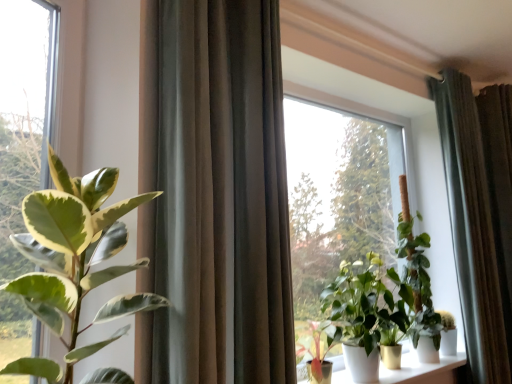
I want to click on white glossy pots at lower center, so click(423, 370).

I want to click on green glossy plant at center, the 2th houseplant positioned from the back, so click(x=366, y=315).

Locate an element on the screen. The height and width of the screenshot is (384, 512). satin dark green curtain at right, the second curtain in the left-to-right sequence is located at coordinates [473, 231].

At what (x,y) coordinates should I click in order to perform the action: click on green leafy plant at left. Please return your answer as a coordinate pair (x, y). Looking at the image, I should click on (25, 113).

This screenshot has height=384, width=512. Describe the element at coordinates (317, 348) in the screenshot. I see `green matte plant at center, the second houseplant in the left-to-right sequence` at that location.

Measure the distance between point (318,340) and camera.

They are 7.11 feet apart.

The height and width of the screenshot is (384, 512). Describe the element at coordinates (74, 261) in the screenshot. I see `green glossy leafy plant at left, positioned as the 4th houseplant in back-to-front order` at that location.

You are a GUI agent. You are given a task and a screenshot of the screen. Output one action in this format:
    pyautogui.click(x=<x>, y=<y>)
    Task: Click on the white glossy pots at lower center
    The width and height of the screenshot is (512, 384).
    Given the screenshot: What is the action you would take?
    pyautogui.click(x=423, y=370)

Can you confirm if green leafy plant at left is shorter than satin dark green curtain at right, positioned as the first curtain in right-to-left order?

Indeed, green leafy plant at left has a lesser height compared to satin dark green curtain at right, positioned as the first curtain in right-to-left order.

Which of these two, green leafy plant at left or satin dark green curtain at right, which is counted as the first curtain, starting from the back, is wider?

Wider between the two is satin dark green curtain at right, which is counted as the first curtain, starting from the back.

Where is `the 2nd curtain behind the green leafy plant at left`? the 2nd curtain behind the green leafy plant at left is located at coordinates (473, 231).

From the image's perspective, is green leafy plant at left on top of satin dark green curtain at right, positioned as the first curtain in right-to-left order?

Yes, from the image's perspective, green leafy plant at left is over satin dark green curtain at right, positioned as the first curtain in right-to-left order.

Does point (236, 171) come behind point (464, 322)?

No, (236, 171) is in front of (464, 322).

Could you tell me if satin brown curtain at center, the 2th curtain from the back, is turned towards satin dark green curtain at right, the second curtain in the left-to-right sequence?

No, satin brown curtain at center, the 2th curtain from the back, is not oriented towards satin dark green curtain at right, the second curtain in the left-to-right sequence.

Can you see satin brown curtain at center, the 2th curtain from the back, touching satin dark green curtain at right, which is counted as the first curtain, starting from the back?

No, satin brown curtain at center, the 2th curtain from the back, is not touching satin dark green curtain at right, which is counted as the first curtain, starting from the back.

Is green glossy leafy plant at left, positioned as the 4th houseplant in back-to-front order, positioned far away from satin dark green curtain at right, which is counted as the first curtain, starting from the back?

Yes, green glossy leafy plant at left, positioned as the 4th houseplant in back-to-front order, is far from satin dark green curtain at right, which is counted as the first curtain, starting from the back.

Considering the relative sizes of green glossy leafy plant at left, which appears as the first houseplant when viewed from the front, and satin dark green curtain at right, positioned as the first curtain in right-to-left order, in the image provided, is green glossy leafy plant at left, which appears as the first houseplant when viewed from the front, thinner than satin dark green curtain at right, positioned as the first curtain in right-to-left order,?

Incorrect, the width of green glossy leafy plant at left, which appears as the first houseplant when viewed from the front, is not less than that of satin dark green curtain at right, positioned as the first curtain in right-to-left order.

Would you say green glossy leafy plant at left, placed as the fourth houseplant when sorted from right to left, is inside or outside satin dark green curtain at right, which is counted as the first curtain, starting from the back?

The correct answer is: outside.

From the image's perspective, which one is positioned lower, green glossy leafy plant at left, which appears as the first houseplant when viewed from the front, or satin dark green curtain at right, arranged as the second curtain when viewed from the front?

green glossy leafy plant at left, which appears as the first houseplant when viewed from the front, appears lower in the image.

In the image, is white glossy pots at lower center positioned in front of or behind green leafy plant at left?

white glossy pots at lower center is behind green leafy plant at left.

From a real-world perspective, who is located lower, white glossy pots at lower center or green leafy plant at left?

white glossy pots at lower center is physically lower.

Consider the image. Considering the positions of objects white glossy pots at lower center and green leafy plant at left in the image provided, who is more to the right, white glossy pots at lower center or green leafy plant at left?

white glossy pots at lower center is more to the right.

Do you think white glossy pots at lower center is within green leafy plant at left, or outside of it?

The correct answer is: outside.

Locate an element on the screen. curtain that is on the right side of green glossy plant at center, the 3th houseplant in the front-to-back sequence is located at coordinates (473, 231).

Is satin dark green curtain at right, which is counted as the first curtain, starting from the back, smaller than green glossy plant at center, the 2th houseplant positioned from the back?

No, satin dark green curtain at right, which is counted as the first curtain, starting from the back, is not smaller than green glossy plant at center, the 2th houseplant positioned from the back.

Between satin dark green curtain at right, the second curtain in the left-to-right sequence, and green glossy plant at center, the 2th houseplant positioned from the back, which one is positioned in front?

green glossy plant at center, the 2th houseplant positioned from the back, is in front.

Which is more distant, (505, 378) or (345, 348)?

The point (505, 378) is farther.

How different are the orientations of white glossy pots at lower center and green matte plant at center, the third houseplant when ordered from back to front, in degrees?

The facing directions of white glossy pots at lower center and green matte plant at center, the third houseplant when ordered from back to front, are 0.0239 degrees apart.

Is white glossy pots at lower center positioned behind green matte plant at center, marked as the second houseplant in a front-to-back arrangement?

Yes, the depth of white glossy pots at lower center is greater than that of green matte plant at center, marked as the second houseplant in a front-to-back arrangement.

From the image's perspective, would you say white glossy pots at lower center is positioned over green matte plant at center, marked as the second houseplant in a front-to-back arrangement?

No, from the image's perspective, white glossy pots at lower center is not on top of green matte plant at center, marked as the second houseplant in a front-to-back arrangement.

Is the surface of green matte plant at center, positioned as the third houseplant in right-to-left order, in direct contact with white glossy pots at lower center?

No, green matte plant at center, positioned as the third houseplant in right-to-left order, is not beside white glossy pots at lower center.

Looking at their sizes, would you say green matte plant at center, positioned as the third houseplant in right-to-left order, is wider or thinner than white glossy pots at lower center?

In the image, green matte plant at center, positioned as the third houseplant in right-to-left order, appears to be more narrow than white glossy pots at lower center.

Considering the sizes of objects green matte plant at center, marked as the second houseplant in a front-to-back arrangement, and white glossy pots at lower center in the image provided, who is shorter, green matte plant at center, marked as the second houseplant in a front-to-back arrangement, or white glossy pots at lower center?

white glossy pots at lower center.

At what (x,y) coordinates should I click in order to perform the action: click on window above the satin dark green curtain at right, which is counted as the first curtain, starting from the back (from a real-world perspective). Please return your answer as a coordinate pair (x, y). The image size is (512, 384). Looking at the image, I should click on (25, 113).

This screenshot has height=384, width=512. I want to click on curtain in front of the satin dark green curtain at right, the second curtain in the left-to-right sequence, so (x=214, y=193).

When comparing their distances from satin dark green curtain at right, which is counted as the first curtain, starting from the back, does green leafy plant at left or white glossy pots at lower center seem further?

green leafy plant at left.

From the image, which object appears to be nearer to green glossy leafy plant at left, arranged as the 1th houseplant when viewed from the left, white glossy pots at lower center or green glossy plant at center, the 3th houseplant in the front-to-back sequence?

green glossy plant at center, the 3th houseplant in the front-to-back sequence.

Estimate the real-world distances between objects in this image. Which object is closer to white glossy pots at lower center, green matte plant at center, which is the fourth houseplant in front-to-back order, or green matte plant at center, the third houseplant when ordered from back to front?

green matte plant at center, which is the fourth houseplant in front-to-back order, is positioned closer to the anchor white glossy pots at lower center.

Based on the photo, estimate the real-world distances between objects in this image. Which object is closer to green glossy leafy plant at left, placed as the fourth houseplant when sorted from right to left, green glossy plant at center, which appears as the third houseplant when viewed from the left, or green matte plant at center, the third houseplant when ordered from back to front?

green matte plant at center, the third houseplant when ordered from back to front, is closer to green glossy leafy plant at left, placed as the fourth houseplant when sorted from right to left.

Looking at the image, which one is located further to green matte plant at center, the third houseplant when ordered from back to front, white glossy pots at lower center or green glossy plant at center, the 2th houseplant positioned from the back?

white glossy pots at lower center.

Which object lies further to the anchor point green matte plant at center, which is the fourth houseplant in front-to-back order, white glossy pots at lower center or satin brown curtain at center, the 1th curtain in the front-to-back sequence?

satin brown curtain at center, the 1th curtain in the front-to-back sequence, lies further to green matte plant at center, which is the fourth houseplant in front-to-back order, than the other object.

When comparing their distances from green leafy plant at left, does green matte plant at center, marked as the second houseplant in a front-to-back arrangement, or white glossy pots at lower center seem closer?

green matte plant at center, marked as the second houseplant in a front-to-back arrangement, is closer to green leafy plant at left.

From the image, which object appears to be nearer to white glossy pots at lower center, satin dark green curtain at right, positioned as the first curtain in right-to-left order, or green matte plant at center, which is the fourth houseplant in front-to-back order?

green matte plant at center, which is the fourth houseplant in front-to-back order, is closer to white glossy pots at lower center.

You are a GUI agent. You are given a task and a screenshot of the screen. Output one action in this format:
    pyautogui.click(x=<x>, y=<y>)
    Task: Click on the houseplant located between green leafy plant at left and satin brown curtain at center, the 1th curtain in the front-to-back sequence, in the left-right direction
    
    Given the screenshot: What is the action you would take?
    pyautogui.click(x=74, y=261)

At what (x,y) coordinates should I click in order to perform the action: click on curtain between green leafy plant at left and satin dark green curtain at right, arranged as the second curtain when viewed from the front, from left to right. Please return your answer as a coordinate pair (x, y). Looking at the image, I should click on (214, 193).

I want to click on curtain located between green glossy leafy plant at left, arranged as the 1th houseplant when viewed from the left, and white glossy pots at lower center in the left-right direction, so click(214, 193).

Find the location of a particular element. window sill between satin brown curtain at center, positioned as the 1th curtain in left-to-right order, and green matte plant at center, arranged as the 4th houseplant when viewed from the left, in the horizontal direction is located at coordinates (423, 370).